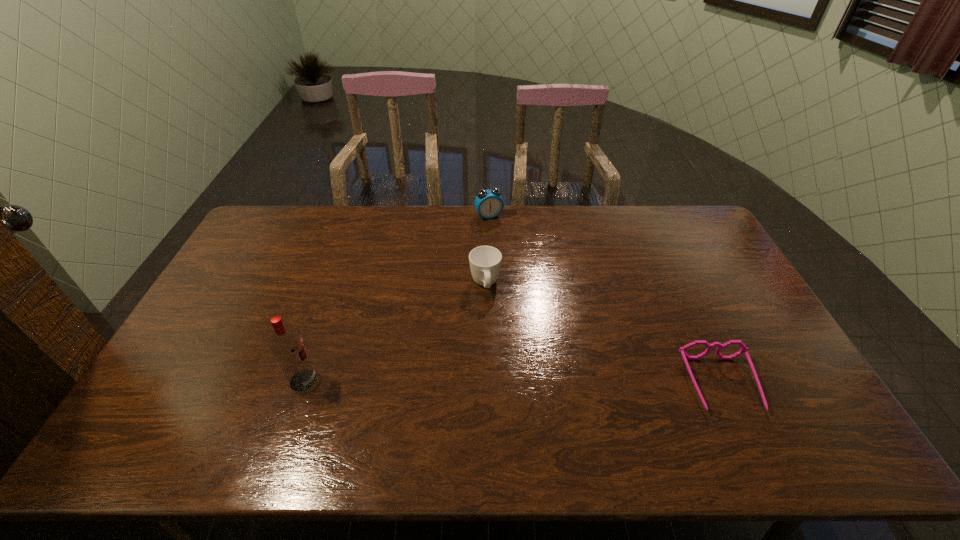
This screenshot has width=960, height=540. I want to click on free region located on the face of the alarm clock, so click(x=528, y=291).

You are a GUI agent. You are given a task and a screenshot of the screen. Output one action in this format:
    pyautogui.click(x=<x>, y=<y>)
    Task: Click on the vacant space positioned on the face of the alarm clock
    
    Given the screenshot: What is the action you would take?
    pyautogui.click(x=527, y=289)

Locate an element on the screen. vacant space located 0.090m on the face of the alarm clock is located at coordinates (500, 235).

What are the coordinates of `object at the far edge` in the screenshot? It's located at (488, 203).

The image size is (960, 540). In order to click on vodka that is at the near edge in this screenshot , I will do `click(286, 343)`.

Identify the location of spectacles located in the near edge section of the desktop. (744, 349).

Where is `object positioned at the right edge`? Image resolution: width=960 pixels, height=540 pixels. object positioned at the right edge is located at coordinates (744, 349).

This screenshot has height=540, width=960. What are the coordinates of `object at the near right corner` in the screenshot? It's located at (744, 349).

The height and width of the screenshot is (540, 960). Identify the location of vacant space at the far edge of the desktop. (312, 242).

Locate an element on the screen. Image resolution: width=960 pixels, height=540 pixels. free space at the left edge is located at coordinates (215, 353).